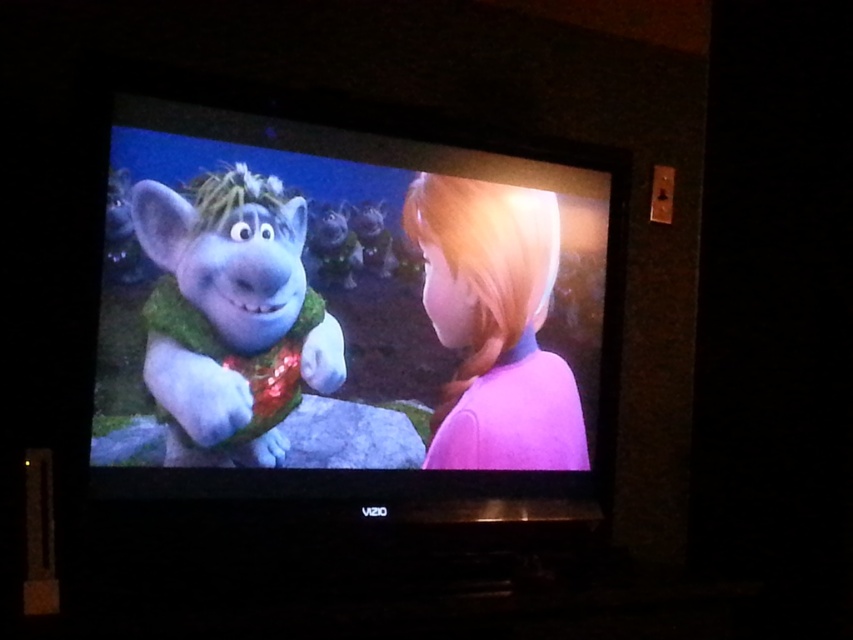
You are a character in the animated scene on the TV screen. You need to locate the fluffy green scarf at left. What are its coordinates?

The fluffy green scarf at left is located at coordinates point (230, 316).

You are watching the TV and see two points on the screen. The first point is at coordinate point (x=426, y=314) and the second is at coordinate point (x=268, y=403). Which point is closer to the bottom edge of the TV screen?

Point (x=268, y=403) is closer to the bottom edge of the TV screen because it is in front of point (x=426, y=314).